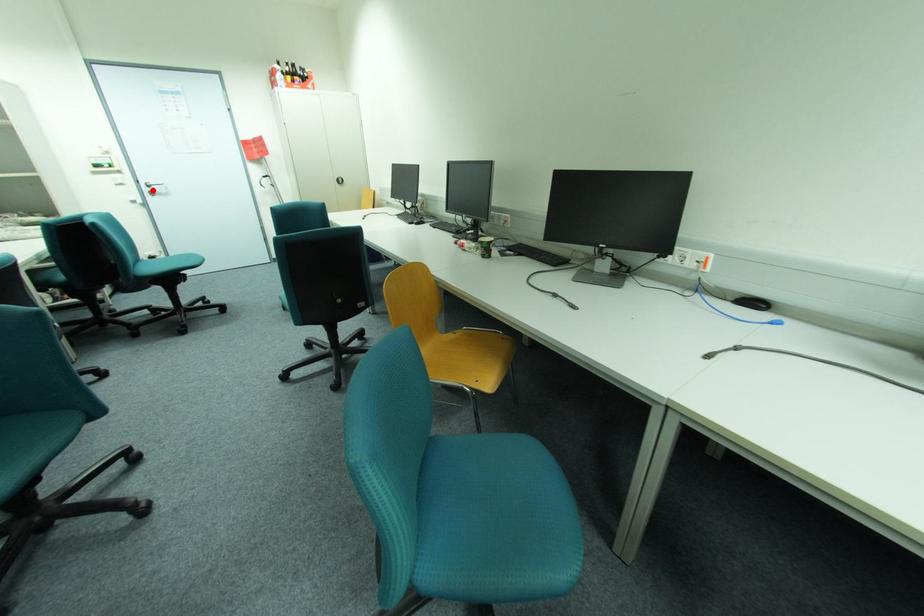
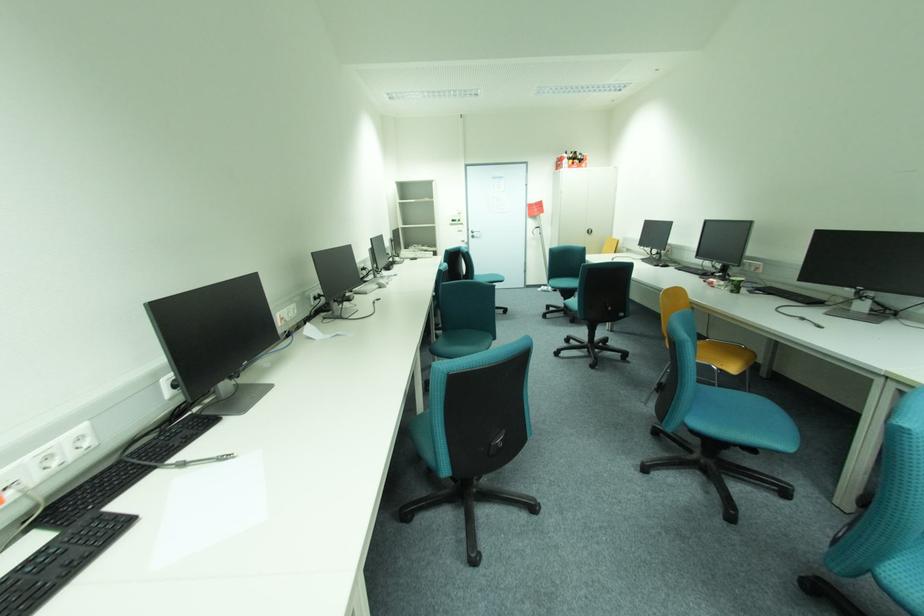
Question: I am providing you with two images of the same scene from different viewpoints. In image1, a red point is highlighted. Considering the same 3D point in image2, which of the following is correct?

Choices:
 (A) It is closer
 (B) It is farther

Answer: (A)